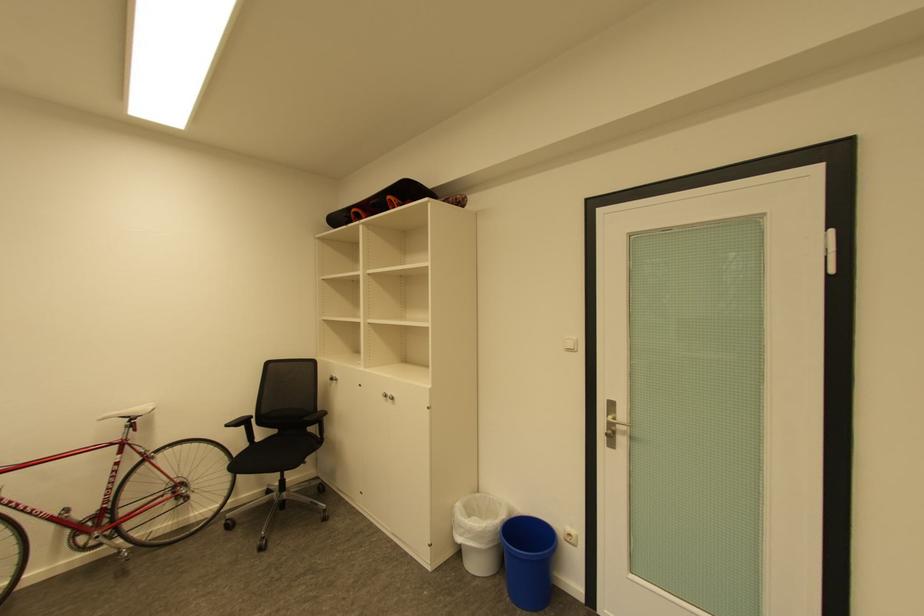
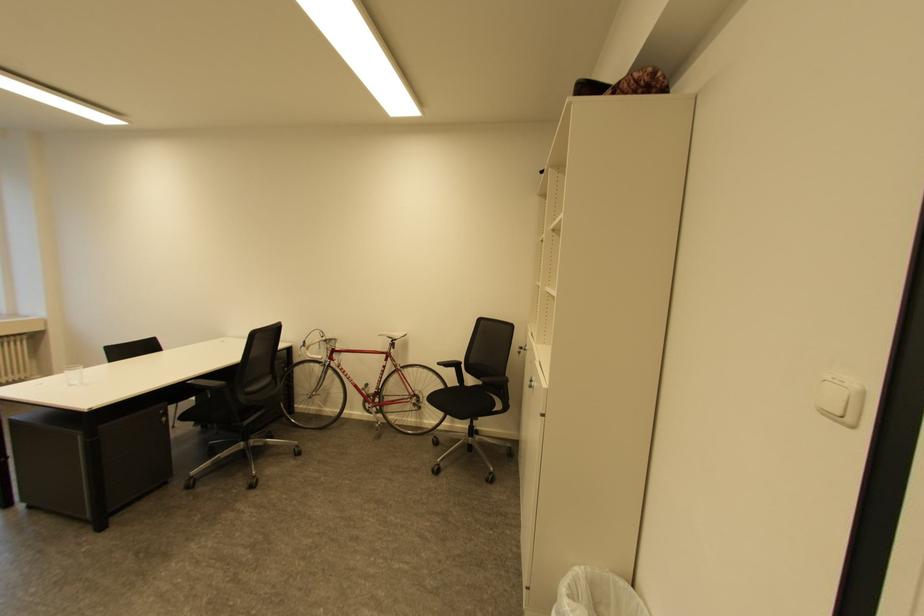
Where in the second image is the point corresponding to point (249, 428) from the first image?

(459, 370)